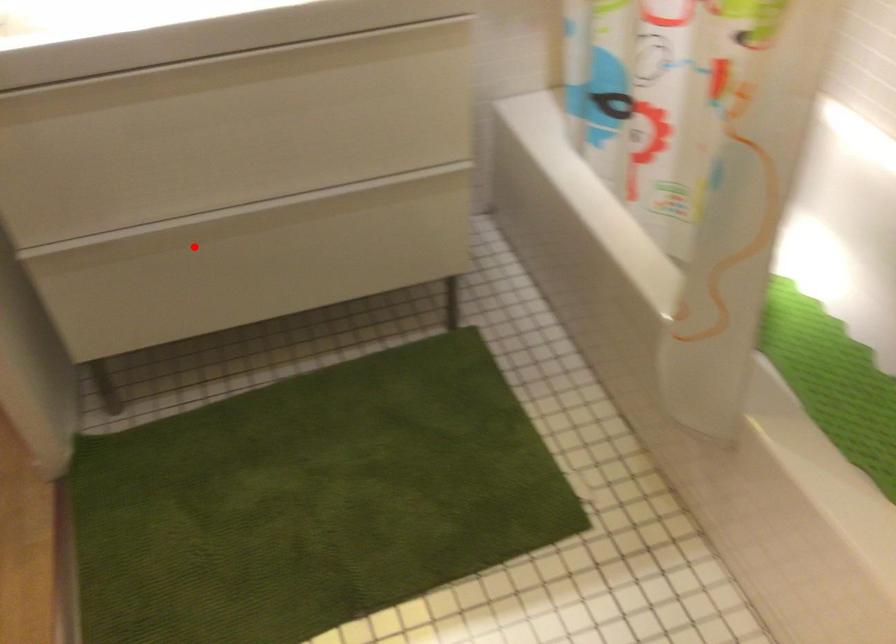
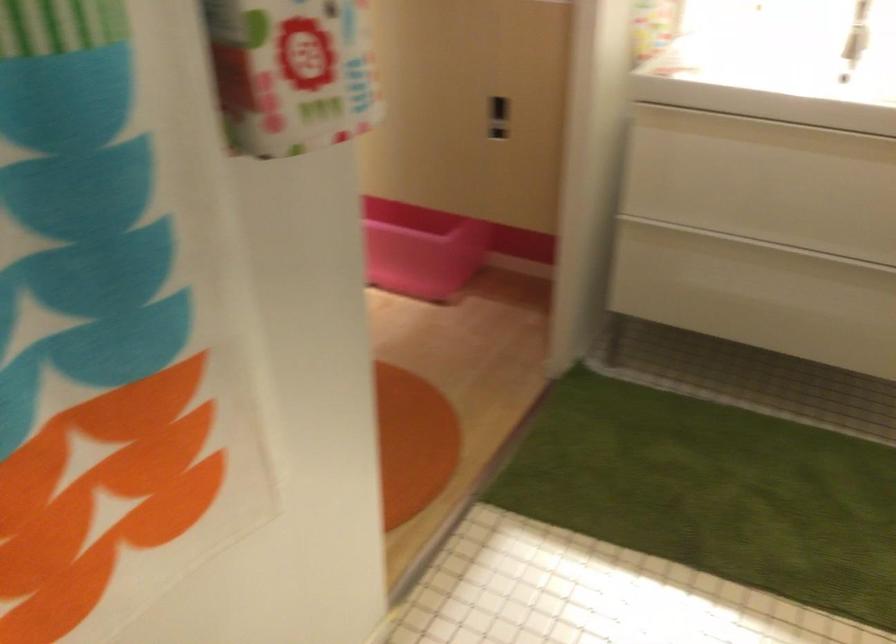
Question: I am providing you with two images of the same scene from different viewpoints. A red point is shown in image1. For the corresponding object point in image2, is it positioned nearer or farther from the camera?

Choices:
 (A) Nearer
 (B) Farther

Answer: (B)